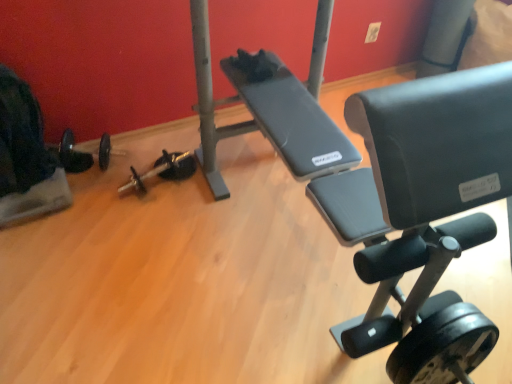
Question: Considering the relative sizes of black rubber dumbbell at center, positioned as the 2th dumbbell in right-to-left order, and black rubber dumbbell at lower right, which is the first dumbbell from front to back, in the image provided, is black rubber dumbbell at center, positioned as the 2th dumbbell in right-to-left order, smaller than black rubber dumbbell at lower right, which is the first dumbbell from front to back,?

Choices:
 (A) no
 (B) yes

Answer: (B)

Question: From the image's perspective, is black rubber dumbbell at center, which is the 1th dumbbell in back-to-front order, beneath black rubber dumbbell at lower right, the third dumbbell positioned from the top?

Choices:
 (A) yes
 (B) no

Answer: (B)

Question: Is black rubber dumbbell at center, positioned as the 2th dumbbell in right-to-left order, behind black rubber dumbbell at lower right, the third dumbbell positioned from the top?

Choices:
 (A) yes
 (B) no

Answer: (A)

Question: Can you confirm if black rubber dumbbell at center, positioned as the third dumbbell in bottom-to-top order, is thinner than black rubber dumbbell at lower right, the third dumbbell positioned from the top?

Choices:
 (A) no
 (B) yes

Answer: (A)

Question: Is black rubber dumbbell at center, the second dumbbell in the left-to-right sequence, in front of black rubber dumbbell at lower right, which is the first dumbbell from front to back?

Choices:
 (A) yes
 (B) no

Answer: (B)

Question: Looking at their shapes, would you say white matte pole at upper right is wider or thinner than velvet black swivel chair at left?

Choices:
 (A) wide
 (B) thin

Answer: (B)

Question: Based on their sizes in the image, would you say white matte pole at upper right is bigger or smaller than velvet black swivel chair at left?

Choices:
 (A) big
 (B) small

Answer: (B)

Question: Considering the positions of point (436, 21) and point (17, 100), is point (436, 21) closer or farther from the camera than point (17, 100)?

Choices:
 (A) farther
 (B) closer

Answer: (A)

Question: Visually, is white matte pole at upper right positioned to the left or to the right of velvet black swivel chair at left?

Choices:
 (A) right
 (B) left

Answer: (A)

Question: Is white matte pole at upper right in front of or behind black rubber dumbbell at center, the second dumbbell in the left-to-right sequence, in the image?

Choices:
 (A) behind
 (B) front

Answer: (A)

Question: Considering the positions of white matte pole at upper right and black rubber dumbbell at center, positioned as the third dumbbell in bottom-to-top order, in the image, is white matte pole at upper right bigger or smaller than black rubber dumbbell at center, positioned as the third dumbbell in bottom-to-top order,?

Choices:
 (A) small
 (B) big

Answer: (B)

Question: From a real-world perspective, is white matte pole at upper right physically located above or below black rubber dumbbell at center, the second dumbbell in the left-to-right sequence?

Choices:
 (A) above
 (B) below

Answer: (A)

Question: Is white matte pole at upper right to the left or to the right of black rubber dumbbell at center, which is the first dumbbell in top-to-bottom order, in the image?

Choices:
 (A) right
 (B) left

Answer: (A)

Question: Does point (173, 175) appear closer or farther from the camera than point (45, 165)?

Choices:
 (A) farther
 (B) closer

Answer: (A)

Question: Is black rubber dumbbell at center, positioned as the third dumbbell in bottom-to-top order, inside or outside of velvet black swivel chair at left?

Choices:
 (A) inside
 (B) outside

Answer: (B)